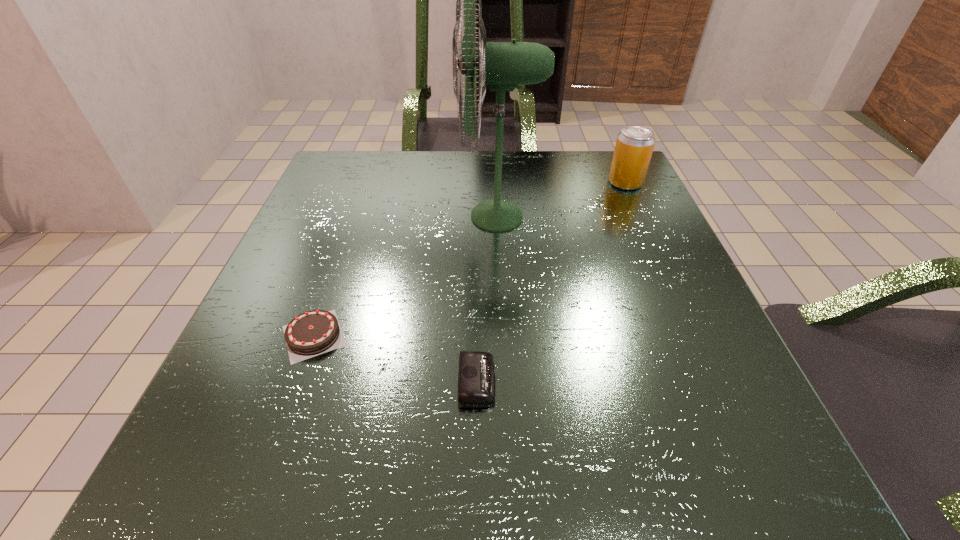
Find the location of a particular element. This screenshot has height=540, width=960. vacant point located on the right of the chocolate cake is located at coordinates (546, 335).

This screenshot has height=540, width=960. I want to click on free location located on the display of the alarm clock, so click(x=676, y=381).

You are a GUI agent. You are given a task and a screenshot of the screen. Output one action in this format:
    pyautogui.click(x=<x>, y=<y>)
    Task: Click on the fan located in the far edge section of the desktop
    This screenshot has height=540, width=960.
    Given the screenshot: What is the action you would take?
    pyautogui.click(x=502, y=65)

Where is `pop (soda) present at the far edge`? The image size is (960, 540). pop (soda) present at the far edge is located at coordinates (634, 146).

Locate an element on the screen. object positioned at the left edge is located at coordinates (315, 332).

Locate an element on the screen. The height and width of the screenshot is (540, 960). object that is at the right edge is located at coordinates click(634, 146).

Locate an element on the screen. object located in the far right corner section of the desktop is located at coordinates (634, 146).

Find the location of `vacant space at the far edge`. vacant space at the far edge is located at coordinates (453, 185).

The height and width of the screenshot is (540, 960). In the image, there is a desktop. In order to click on vacant space at the near edge in this screenshot , I will do `click(527, 501)`.

Image resolution: width=960 pixels, height=540 pixels. I want to click on free region at the left edge, so click(235, 397).